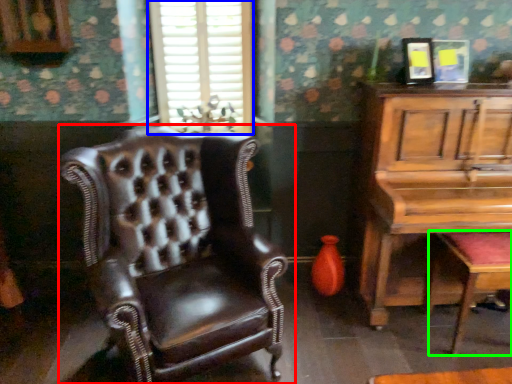
Question: Considering the real-world distances, which object is closest to chair (highlighted by a red box)? window (highlighted by a blue box) or music stool (highlighted by a green box).

Choices:
 (A) window
 (B) music stool

Answer: (A)